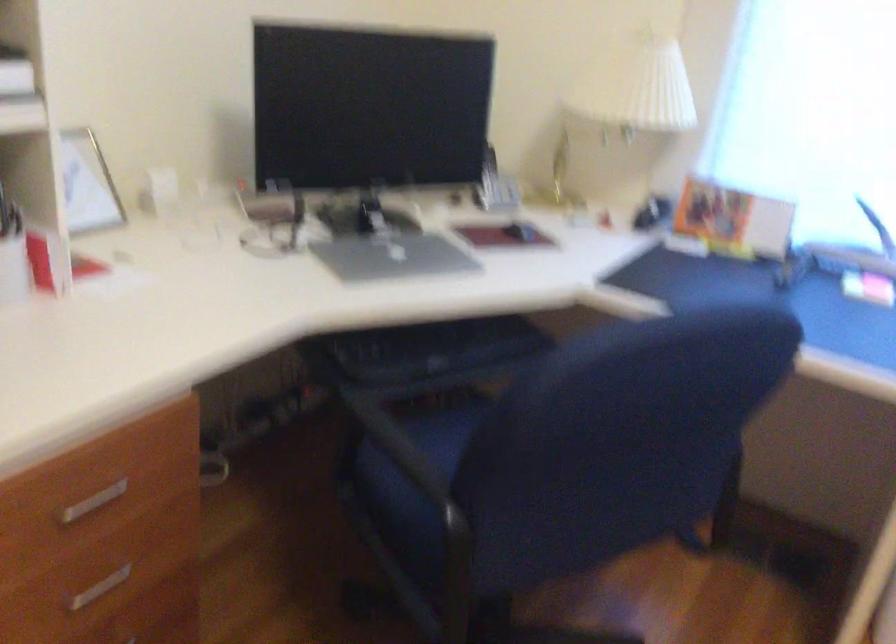
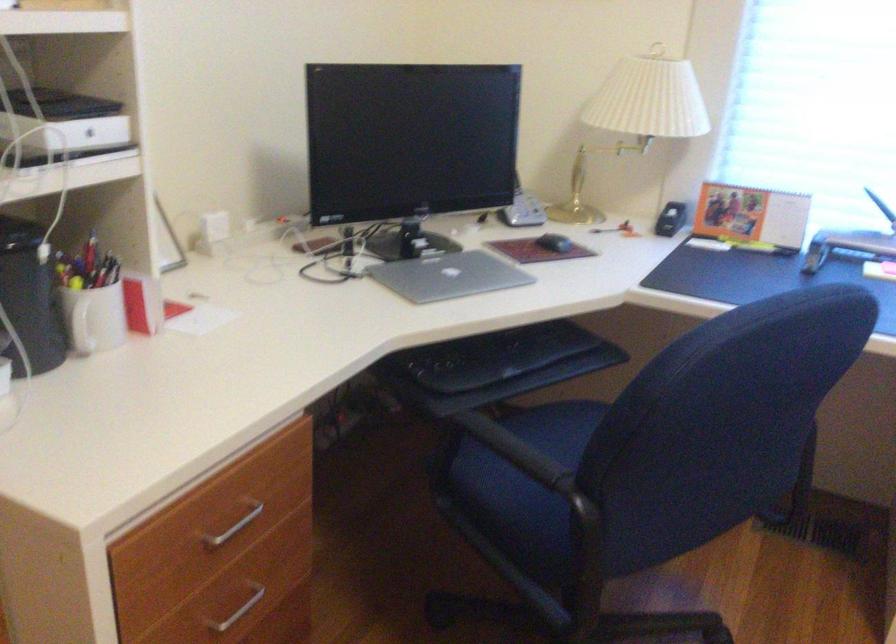
The point at (392, 256) is marked in the first image. Where is the corresponding point in the second image?

(449, 276)